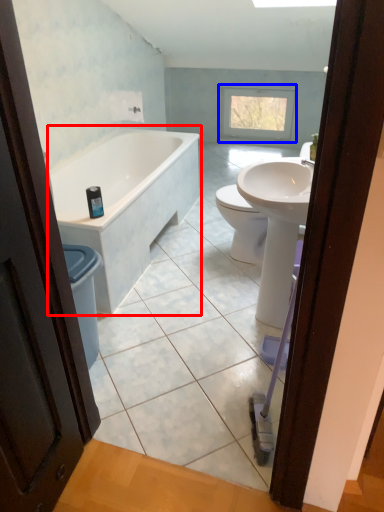
Question: Which object appears farthest to the camera in this image, bathtub (highlighted by a red box) or window (highlighted by a blue box)?

Choices:
 (A) bathtub
 (B) window

Answer: (B)